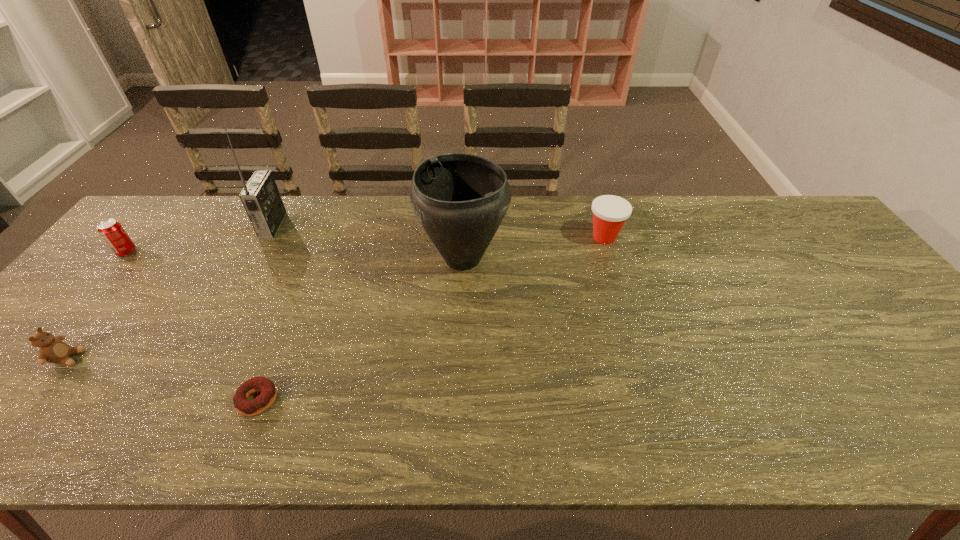
The height and width of the screenshot is (540, 960). What are the coordinates of `vacant position at the far edge of the desktop` in the screenshot? It's located at (541, 242).

You are a GUI agent. You are given a task and a screenshot of the screen. Output one action in this format:
    pyautogui.click(x=<x>, y=<y>)
    Task: Click on the vacant space at the near edge
    
    Given the screenshot: What is the action you would take?
    pyautogui.click(x=605, y=433)

The image size is (960, 540). I want to click on free region at the left edge of the desktop, so click(140, 262).

Where is `blank space at the right edge`? The image size is (960, 540). blank space at the right edge is located at coordinates (818, 280).

Identify the location of free space at the far right corner of the desktop. This screenshot has height=540, width=960. (804, 217).

Locate an element on the screen. This screenshot has width=960, height=540. vacant space that is in between the radio receiver and the second nearest object is located at coordinates (171, 292).

Where is `vacant point located between the Dixie cup and the leftmost object`? Image resolution: width=960 pixels, height=540 pixels. vacant point located between the Dixie cup and the leftmost object is located at coordinates (366, 245).

Locate an element on the screen. This screenshot has height=540, width=960. free point between the teddy bear and the urn is located at coordinates (266, 308).

I want to click on vacant area that lies between the teddy bear and the urn, so click(266, 308).

This screenshot has height=540, width=960. Identify the location of free space between the shortest object and the teddy bear. (163, 379).